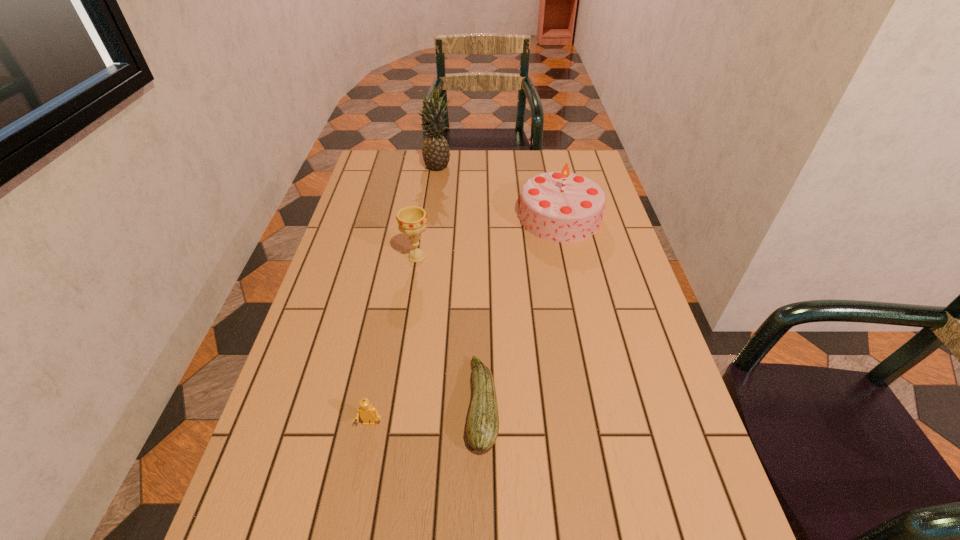
You are a GUI agent. You are given a task and a screenshot of the screen. Output one action in this format:
    pyautogui.click(x=<x>, y=<y>)
    Task: Click on the free region located on the front of the birthday cake
    This screenshot has width=960, height=540.
    Given the screenshot: What is the action you would take?
    pyautogui.click(x=568, y=256)

Identify the location of blank space located on the front of the third nearest object. (402, 348).

Where is `free region located 0.110m on the face of the fourth tallest object`? free region located 0.110m on the face of the fourth tallest object is located at coordinates (359, 482).

At what (x,y) coordinates should I click in order to perform the action: click on free location located 0.270m at the stem end of the shortest object. Please return your answer as a coordinate pair (x, y). The width and height of the screenshot is (960, 540). Looking at the image, I should click on (347, 405).

Locate an element on the screen. This screenshot has width=960, height=540. free spot located at the stem end of the shortest object is located at coordinates (355, 405).

At what (x,y) coordinates should I click in order to perform the action: click on vacant space located 0.210m at the stem end of the shortest object. Please return your answer as a coordinate pair (x, y). The width and height of the screenshot is (960, 540). Looking at the image, I should click on (373, 405).

The image size is (960, 540). Find the location of `object positioned at the far edge`. object positioned at the far edge is located at coordinates (435, 151).

Identify the location of object positioned at the right edge. The width and height of the screenshot is (960, 540). (564, 207).

Find the location of `free region at the far edge of the desktop`. free region at the far edge of the desktop is located at coordinates (457, 182).

Where is `vacant space at the left edge`? The height and width of the screenshot is (540, 960). vacant space at the left edge is located at coordinates (346, 232).